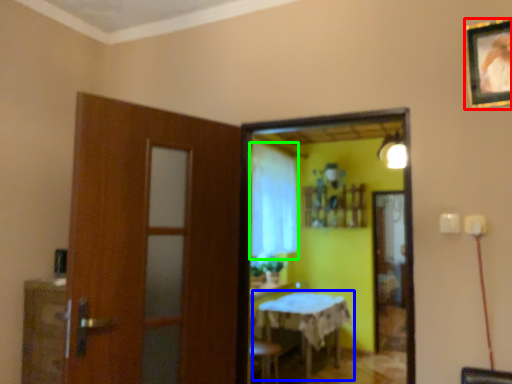
Question: Which object is the closest to the picture frame (highlighted by a red box)? Choose among these: table (highlighted by a blue box) or curtain (highlighted by a green box).

Choices:
 (A) table
 (B) curtain

Answer: (A)